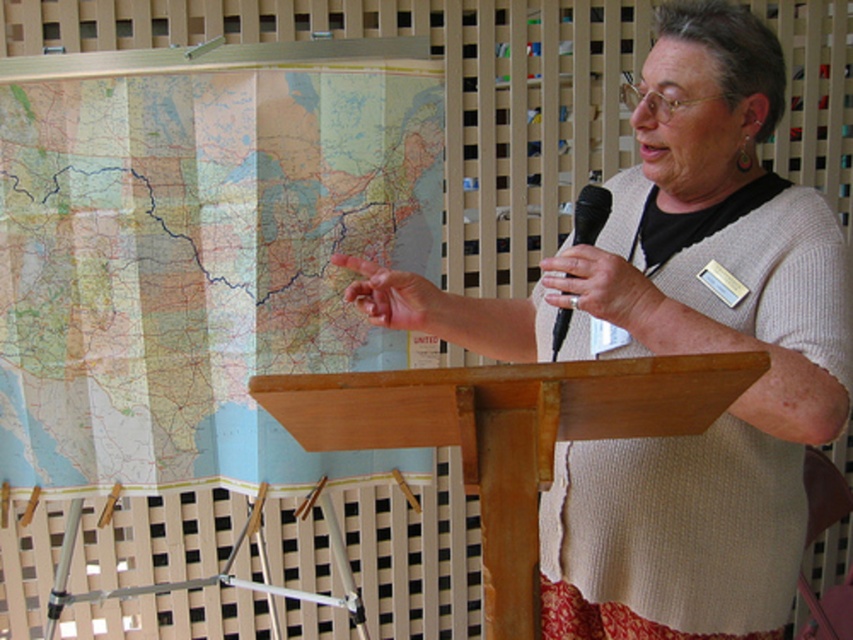
Does knitted beige sweater at center appear over wooden podium at center?

Correct, knitted beige sweater at center is located above wooden podium at center.

Does knitted beige sweater at center have a greater width compared to wooden podium at center?

Yes, knitted beige sweater at center is wider than wooden podium at center.

Does point (699, 596) come in front of point (624, 419)?

No, (699, 596) is behind (624, 419).

Where is `knitted beige sweater at center`? Image resolution: width=853 pixels, height=640 pixels. knitted beige sweater at center is located at coordinates (679, 349).

Measure the distance between wooden podium at center and black plastic microphone at upper right.

wooden podium at center is 13.84 inches away from black plastic microphone at upper right.

Is point (538, 474) in front of point (585, 186)?

Yes, point (538, 474) is in front of point (585, 186).

Does point (357, 380) come farther from viewer compared to point (595, 184)?

No.

Identify the location of wooden podium at center. Image resolution: width=853 pixels, height=640 pixels. (508, 435).

Image resolution: width=853 pixels, height=640 pixels. In order to click on paper map at left in this screenshot , I will do `click(200, 253)`.

Between paper map at left and wooden podium at center, which one appears on the right side from the viewer's perspective?

wooden podium at center is more to the right.

Does point (187, 108) come behind point (593, 369)?

That is True.

Where is `paper map at left`? paper map at left is located at coordinates (200, 253).